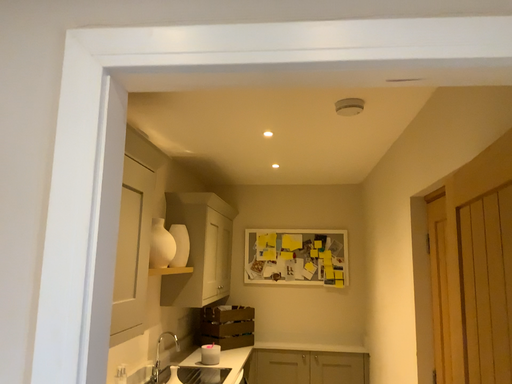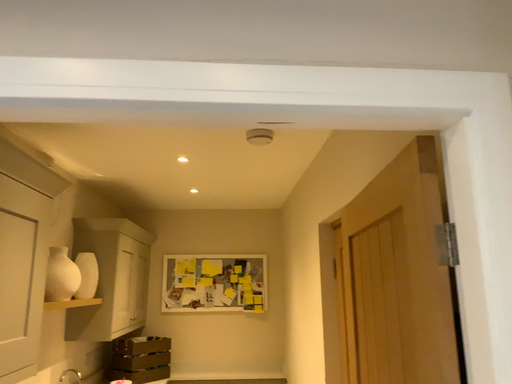
Question: How did the camera likely rotate when shooting the video?

Choices:
 (A) rotated right
 (B) rotated left

Answer: (A)